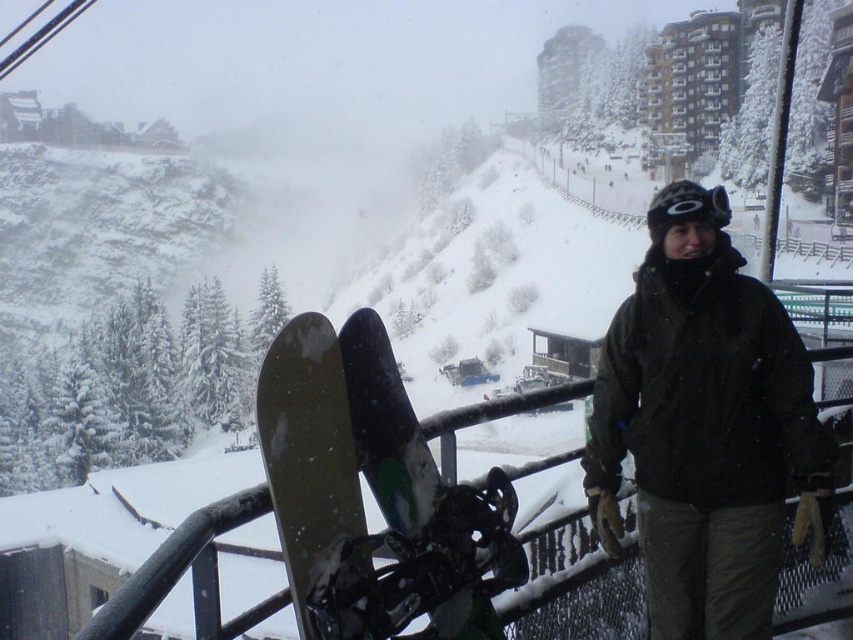
You are a photographer trying to capture both the dark green jacket at center and the matte black snowboard at lower center in a single shot. Given their sizes, which object should you focus on to ensure both are clearly visible in your photo?

The dark green jacket at center is bigger than the matte black snowboard at lower center, so focusing on the dark green jacket at center will help ensure both objects are clearly visible in the photo.

You are a photographer planning to take a closeup shot of the green matte snowboard at center and the black matte goggles at center. Which object will require you to zoom in more to capture its details?

The green matte snowboard at center occupies less space than the black matte goggles at center, so you will need to zoom in more to capture the details of the green matte snowboard at center.